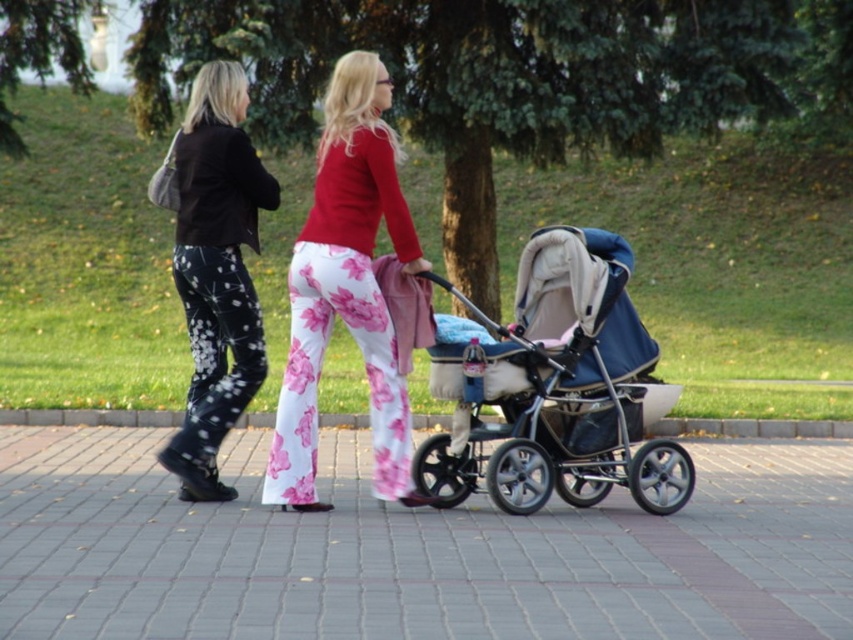
Does gray concrete pavement at center appear over black matte pants at left?

Actually, gray concrete pavement at center is below black matte pants at left.

Is gray concrete pavement at center positioned at the back of black matte pants at left?

No, gray concrete pavement at center is in front of black matte pants at left.

This screenshot has width=853, height=640. Identify the location of gray concrete pavement at center. (415, 550).

Between blue fabric stroller at center and gray concrete pavement at center, which one is positioned lower?

gray concrete pavement at center

Can you confirm if blue fabric stroller at center is positioned above gray concrete pavement at center?

Yes, blue fabric stroller at center is above gray concrete pavement at center.

Image resolution: width=853 pixels, height=640 pixels. In order to click on blue fabric stroller at center in this screenshot , I will do `click(589, 160)`.

Is point (10, 227) positioned behind point (244, 342)?

Yes, point (10, 227) is behind point (244, 342).

Looking at this image, between blue fabric stroller at center and black matte pants at left, which one is positioned lower?

Positioned lower is black matte pants at left.

Does point (15, 365) come in front of point (167, 458)?

No, (15, 365) is behind (167, 458).

At what (x,y) coordinates should I click in order to perform the action: click on blue fabric stroller at center. Please return your answer as a coordinate pair (x, y). The height and width of the screenshot is (640, 853). Looking at the image, I should click on (589, 160).